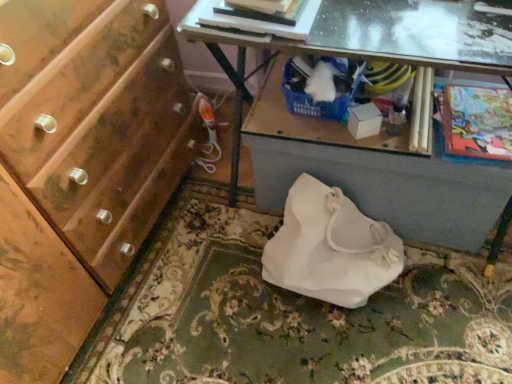
Question: Could you tell me if transparent glass table at upper center is turned towards cartoon paper comic book at right?

Choices:
 (A) no
 (B) yes

Answer: (A)

Question: Is transparent glass table at upper center completely or partially outside of cartoon paper comic book at right?

Choices:
 (A) no
 (B) yes

Answer: (B)

Question: From the image's perspective, would you say transparent glass table at upper center is positioned over cartoon paper comic book at right?

Choices:
 (A) no
 (B) yes

Answer: (B)

Question: From a real-world perspective, is transparent glass table at upper center positioned under cartoon paper comic book at right based on gravity?

Choices:
 (A) no
 (B) yes

Answer: (A)

Question: Can you confirm if transparent glass table at upper center is thinner than cartoon paper comic book at right?

Choices:
 (A) no
 (B) yes

Answer: (B)

Question: Does transparent glass table at upper center have a larger size compared to cartoon paper comic book at right?

Choices:
 (A) no
 (B) yes

Answer: (B)

Question: Does white fabric bag at lower center have a greater height compared to cartoon paper comic book at right?

Choices:
 (A) yes
 (B) no

Answer: (A)

Question: Would you say white fabric bag at lower center is outside cartoon paper comic book at right?

Choices:
 (A) no
 (B) yes

Answer: (B)

Question: Is there a large distance between white fabric bag at lower center and cartoon paper comic book at right?

Choices:
 (A) yes
 (B) no

Answer: (B)

Question: From the image's perspective, would you say white fabric bag at lower center is positioned over cartoon paper comic book at right?

Choices:
 (A) no
 (B) yes

Answer: (A)

Question: From the image's perspective, is white fabric bag at lower center beneath cartoon paper comic book at right?

Choices:
 (A) no
 (B) yes

Answer: (B)

Question: Does white fabric bag at lower center have a smaller size compared to cartoon paper comic book at right?

Choices:
 (A) yes
 (B) no

Answer: (B)

Question: Could you tell me if white fabric bag at center is facing hardcover book at upper center?

Choices:
 (A) yes
 (B) no

Answer: (B)